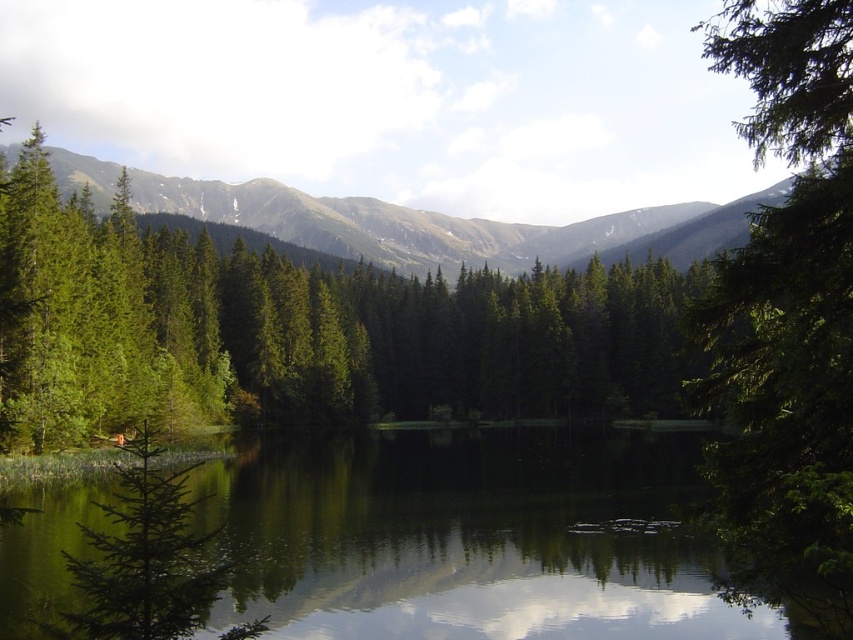
Consider the image. You are standing in the middle of the forest and see the green matte tree at center and the green textured forest at upper center. Which one is closer to you?

The green matte tree at center is closer to you because it is positioned under the green textured forest at upper center, meaning it is in a lower and nearer position.

You are standing at the edge of the lake and see two points in the image. The first point is at coordinate point (610, 564) and the second is at point (718, 380). Which point is closer to you?

Point (610, 564) is closer to you because it is further to the viewer than point (718, 380).